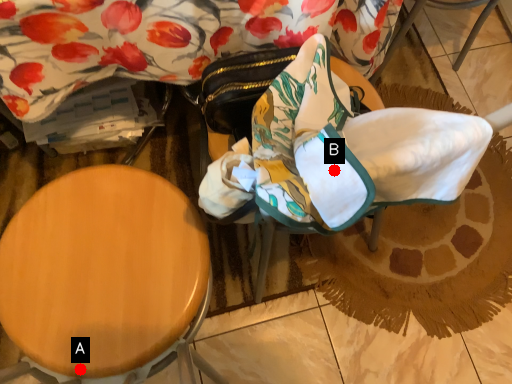
Question: Two points are circled on the image, labeled by A and B beside each circle. Which of the following is the closest to the observer?

Choices:
 (A) A is closer
 (B) B is closer

Answer: (B)